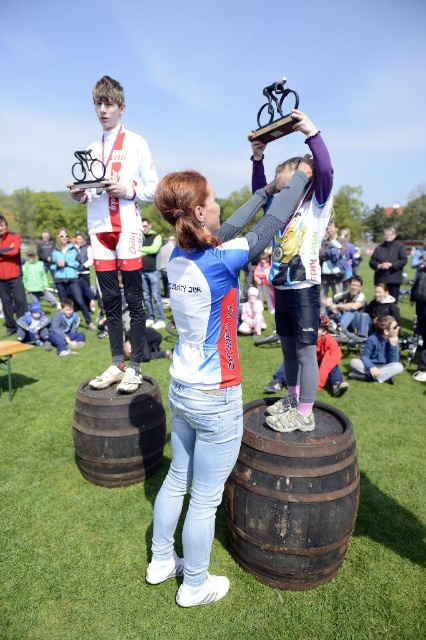
Between dark brown wooden barrel at center and brown wooden barrel at lower center, which one has less height?

Standing shorter between the two is brown wooden barrel at lower center.

Can you confirm if dark brown wooden barrel at center is wider than brown wooden barrel at lower center?

Indeed, dark brown wooden barrel at center has a greater width compared to brown wooden barrel at lower center.

Is point (271, 492) in front of point (155, 401)?

Yes.

You are a GUI agent. You are given a task and a screenshot of the screen. Output one action in this format:
    pyautogui.click(x=<x>, y=<y>)
    Task: Click on the dark brown wooden barrel at center
    This screenshot has height=640, width=426.
    Given the screenshot: What is the action you would take?
    pyautogui.click(x=293, y=499)

Is brown wooden barrel at lower center above metallic silver bicycle at upper center?

No.

Is brown wooden barrel at lower center wider than metallic silver bicycle at upper center?

In fact, brown wooden barrel at lower center might be narrower than metallic silver bicycle at upper center.

Is point (86, 392) closer to camera compared to point (94, 186)?

That is False.

Find the location of a particular element. This screenshot has width=426, height=640. brown wooden barrel at lower center is located at coordinates (118, 433).

Between point (241, 260) and point (278, 516), which one is positioned behind?

Point (278, 516)

Who is lower down, white matte jersey at center or dark brown wooden barrel at center?

dark brown wooden barrel at center is below.

Which is in front, point (236, 260) or point (293, 548)?

Positioned in front is point (236, 260).

In order to click on white matte jersey at center in this screenshot , I will do [206, 365].